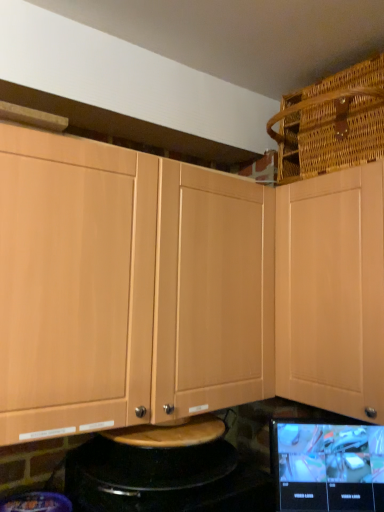
I want to click on light wood cabinet at upper right, positioned as the 1th cabinetry in right-to-left order, so click(x=331, y=291).

At what (x,y) coordinates should I click in order to perform the action: click on matte black tablet at lower right. Please return your answer as a coordinate pair (x, y). Looking at the image, I should click on (327, 465).

Image resolution: width=384 pixels, height=512 pixels. I want to click on woven brown basket at upper right, so click(x=332, y=123).

What are the coordinates of `light wood cabinet at upper left, which appears as the 2th cabinetry when viewed from the right` in the screenshot? It's located at (180, 288).

What are the coordinates of `basket located above the light wood cabinet at upper left, which appears as the 2th cabinetry when viewed from the right (from the image's perspective)` in the screenshot? It's located at (332, 123).

Considering the sizes of objects woven brown basket at upper right and light wood cabinet at upper left, placed as the 1th cabinetry when sorted from left to right, in the image provided, who is shorter, woven brown basket at upper right or light wood cabinet at upper left, placed as the 1th cabinetry when sorted from left to right,?

woven brown basket at upper right.

Which object is closer to the camera, light wood cabinet at upper right, which ranks as the 2th cabinetry in left-to-right order, or matte black tablet at lower right?

light wood cabinet at upper right, which ranks as the 2th cabinetry in left-to-right order, is closer to the camera.

Does light wood cabinet at upper right, which ranks as the 2th cabinetry in left-to-right order, have a lesser width compared to matte black tablet at lower right?

Incorrect, the width of light wood cabinet at upper right, which ranks as the 2th cabinetry in left-to-right order, is not less than that of matte black tablet at lower right.

Which is farther, (278, 197) or (367, 492)?

The point (278, 197) is behind.

Is light wood cabinet at upper right, positioned as the 1th cabinetry in right-to-left order, shorter than matte black tablet at lower right?

Incorrect, the height of light wood cabinet at upper right, positioned as the 1th cabinetry in right-to-left order, does not fall short of that of matte black tablet at lower right.

Which is in front, point (320, 84) or point (374, 225)?

The point (374, 225) is more forward.

Could you measure the distance between woven brown basket at upper right and light wood cabinet at upper right, which ranks as the 2th cabinetry in left-to-right order?

A distance of 11.19 inches exists between woven brown basket at upper right and light wood cabinet at upper right, which ranks as the 2th cabinetry in left-to-right order.

Can you confirm if woven brown basket at upper right is smaller than light wood cabinet at upper right, which ranks as the 2th cabinetry in left-to-right order?

Indeed, woven brown basket at upper right has a smaller size compared to light wood cabinet at upper right, which ranks as the 2th cabinetry in left-to-right order.

Would you say woven brown basket at upper right is a long distance from light wood cabinet at upper right, which ranks as the 2th cabinetry in left-to-right order?

No, woven brown basket at upper right is in close proximity to light wood cabinet at upper right, which ranks as the 2th cabinetry in left-to-right order.

In the image, is light wood cabinet at upper left, which appears as the 2th cabinetry when viewed from the right, positioned in front of or behind matte black tablet at lower right?

light wood cabinet at upper left, which appears as the 2th cabinetry when viewed from the right, is in front of matte black tablet at lower right.

Locate an element on the screen. The width and height of the screenshot is (384, 512). computer monitor located underneath the light wood cabinet at upper left, placed as the 1th cabinetry when sorted from left to right (from a real-world perspective) is located at coordinates (327, 465).

Considering the relative positions of light wood cabinet at upper left, which appears as the 2th cabinetry when viewed from the right, and matte black tablet at lower right in the image provided, is light wood cabinet at upper left, which appears as the 2th cabinetry when viewed from the right, to the right of matte black tablet at lower right from the viewer's perspective?

No, light wood cabinet at upper left, which appears as the 2th cabinetry when viewed from the right, is not to the right of matte black tablet at lower right.

From the image's perspective, is light wood cabinet at upper left, which appears as the 2th cabinetry when viewed from the right, located above matte black tablet at lower right?

Yes.

Based on their sizes in the image, would you say light wood cabinet at upper right, which ranks as the 2th cabinetry in left-to-right order, is bigger or smaller than light wood cabinet at upper left, placed as the 1th cabinetry when sorted from left to right?

Considering their sizes, light wood cabinet at upper right, which ranks as the 2th cabinetry in left-to-right order, takes up less space than light wood cabinet at upper left, placed as the 1th cabinetry when sorted from left to right.

Find the location of a particular element. This screenshot has width=384, height=512. cabinetry on the right of light wood cabinet at upper left, which appears as the 2th cabinetry when viewed from the right is located at coordinates (331, 291).

Between light wood cabinet at upper right, which ranks as the 2th cabinetry in left-to-right order, and light wood cabinet at upper left, placed as the 1th cabinetry when sorted from left to right, which one has more height?

With more height is light wood cabinet at upper right, which ranks as the 2th cabinetry in left-to-right order.

From the image's perspective, which is below, light wood cabinet at upper right, which ranks as the 2th cabinetry in left-to-right order, or light wood cabinet at upper left, which appears as the 2th cabinetry when viewed from the right?

From the image's view, light wood cabinet at upper right, which ranks as the 2th cabinetry in left-to-right order, is below.

From a real-world perspective, is woven brown basket at upper right under matte black tablet at lower right?

No.

From the image's perspective, is woven brown basket at upper right on matte black tablet at lower right?

Yes, from the image's perspective, woven brown basket at upper right is on top of matte black tablet at lower right.

Looking at their sizes, would you say woven brown basket at upper right is wider or thinner than matte black tablet at lower right?

In the image, woven brown basket at upper right appears to be wider than matte black tablet at lower right.

Looking at this image, from the image's perspective, which object appears higher, light wood cabinet at upper right, which ranks as the 2th cabinetry in left-to-right order, or woven brown basket at upper right?

From the image's view, woven brown basket at upper right is above.

Between light wood cabinet at upper right, which ranks as the 2th cabinetry in left-to-right order, and woven brown basket at upper right, which one has larger width?

woven brown basket at upper right.

Is light wood cabinet at upper right, positioned as the 1th cabinetry in right-to-left order, beside woven brown basket at upper right?

No, light wood cabinet at upper right, positioned as the 1th cabinetry in right-to-left order, is not next to woven brown basket at upper right.

How many degrees apart are the facing directions of light wood cabinet at upper right, which ranks as the 2th cabinetry in left-to-right order, and woven brown basket at upper right?

1.25 degrees.

From the woven brown basket at upper right, count 2nd cabinetrys forward and point to it. Please provide its 2D coordinates.

[(180, 288)]

The image size is (384, 512). In order to click on computer monitor below the light wood cabinet at upper right, positioned as the 1th cabinetry in right-to-left order (from the image's perspective) in this screenshot , I will do `click(327, 465)`.

Which object lies further to the anchor point woven brown basket at upper right, light wood cabinet at upper left, placed as the 1th cabinetry when sorted from left to right, or matte black tablet at lower right?

matte black tablet at lower right is positioned further to the anchor woven brown basket at upper right.

Looking at the image, which one is located further to matte black tablet at lower right, light wood cabinet at upper right, positioned as the 1th cabinetry in right-to-left order, or woven brown basket at upper right?

woven brown basket at upper right is positioned further to the anchor matte black tablet at lower right.

Looking at the image, which one is located further to woven brown basket at upper right, light wood cabinet at upper right, positioned as the 1th cabinetry in right-to-left order, or matte black tablet at lower right?

Based on the image, matte black tablet at lower right appears to be further to woven brown basket at upper right.

Looking at the image, which one is located closer to light wood cabinet at upper left, placed as the 1th cabinetry when sorted from left to right, matte black tablet at lower right or woven brown basket at upper right?

matte black tablet at lower right.

Considering their positions, is woven brown basket at upper right positioned closer to matte black tablet at lower right than light wood cabinet at upper right, positioned as the 1th cabinetry in right-to-left order?

The object closer to matte black tablet at lower right is light wood cabinet at upper right, positioned as the 1th cabinetry in right-to-left order.

Estimate the real-world distances between objects in this image. Which object is further from light wood cabinet at upper left, which appears as the 2th cabinetry when viewed from the right, woven brown basket at upper right or matte black tablet at lower right?

woven brown basket at upper right.

Consider the image. Considering their positions, is light wood cabinet at upper right, which ranks as the 2th cabinetry in left-to-right order, positioned closer to woven brown basket at upper right than light wood cabinet at upper left, placed as the 1th cabinetry when sorted from left to right?

The object closer to woven brown basket at upper right is light wood cabinet at upper right, which ranks as the 2th cabinetry in left-to-right order.

Considering their positions, is matte black tablet at lower right positioned closer to light wood cabinet at upper right, positioned as the 1th cabinetry in right-to-left order, than light wood cabinet at upper left, which appears as the 2th cabinetry when viewed from the right?

light wood cabinet at upper left, which appears as the 2th cabinetry when viewed from the right, is closer to light wood cabinet at upper right, positioned as the 1th cabinetry in right-to-left order.

Where is `basket between light wood cabinet at upper left, which appears as the 2th cabinetry when viewed from the right, and light wood cabinet at upper right, which ranks as the 2th cabinetry in left-to-right order`? This screenshot has height=512, width=384. basket between light wood cabinet at upper left, which appears as the 2th cabinetry when viewed from the right, and light wood cabinet at upper right, which ranks as the 2th cabinetry in left-to-right order is located at coordinates (332, 123).

Where is `computer monitor between light wood cabinet at upper left, placed as the 1th cabinetry when sorted from left to right, and light wood cabinet at upper right, positioned as the 1th cabinetry in right-to-left order`? computer monitor between light wood cabinet at upper left, placed as the 1th cabinetry when sorted from left to right, and light wood cabinet at upper right, positioned as the 1th cabinetry in right-to-left order is located at coordinates (327, 465).